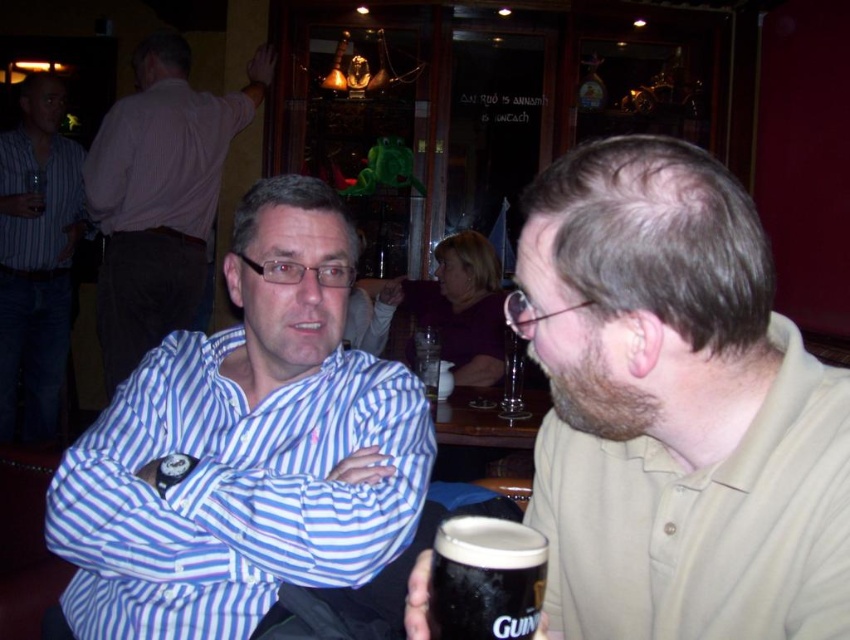
Is point (717, 388) closer to viewer compared to point (225, 147)?

Yes, it is.

Locate an element on the screen. The width and height of the screenshot is (850, 640). matte beige polo shirt at right is located at coordinates (675, 406).

Which is behind, point (151, 218) or point (414, 344)?

Positioned behind is point (151, 218).

Describe the element at coordinates (162, 157) in the screenshot. I see `light brown cotton shirt at upper left` at that location.

At what (x,y) coordinates should I click in order to perform the action: click on light brown cotton shirt at upper left. Please return your answer as a coordinate pair (x, y). This screenshot has height=640, width=850. Looking at the image, I should click on (162, 157).

Which is below, striped shirt at left or clear glass beer at center?

clear glass beer at center is lower down.

Can you confirm if striped shirt at left is bigger than clear glass beer at center?

Indeed, striped shirt at left has a larger size compared to clear glass beer at center.

What do you see at coordinates (37, 259) in the screenshot? This screenshot has height=640, width=850. I see `striped shirt at left` at bounding box center [37, 259].

Find the location of a particular element. This screenshot has width=850, height=640. striped shirt at left is located at coordinates (x=37, y=259).